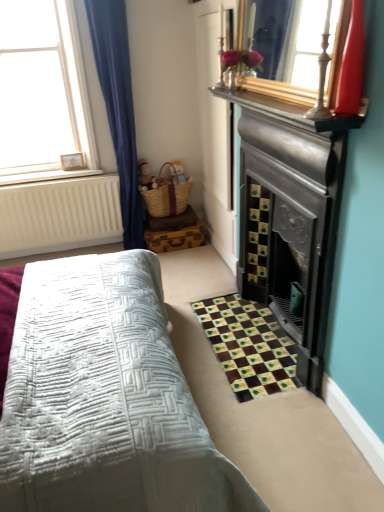
Question: From the image's perspective, is brown fabric rug at lower right positioned above or below shiny red glass vase at upper right?

Choices:
 (A) above
 (B) below

Answer: (B)

Question: Is point coord(271,354) closer or farther from the camera than point coord(344,66)?

Choices:
 (A) closer
 (B) farther

Answer: (B)

Question: Considering the real-world distances, which object is farthest from the wooden picture frame at upper left?

Choices:
 (A) white wooden frame at upper left
 (B) shiny red glass vase at upper right
 (C) brown fabric rug at lower right

Answer: (B)

Question: Which object is the closest to the wooden picture frame at upper left?

Choices:
 (A) shiny red glass vase at upper right
 (B) white wooden frame at upper left
 (C) brown fabric rug at lower right

Answer: (B)